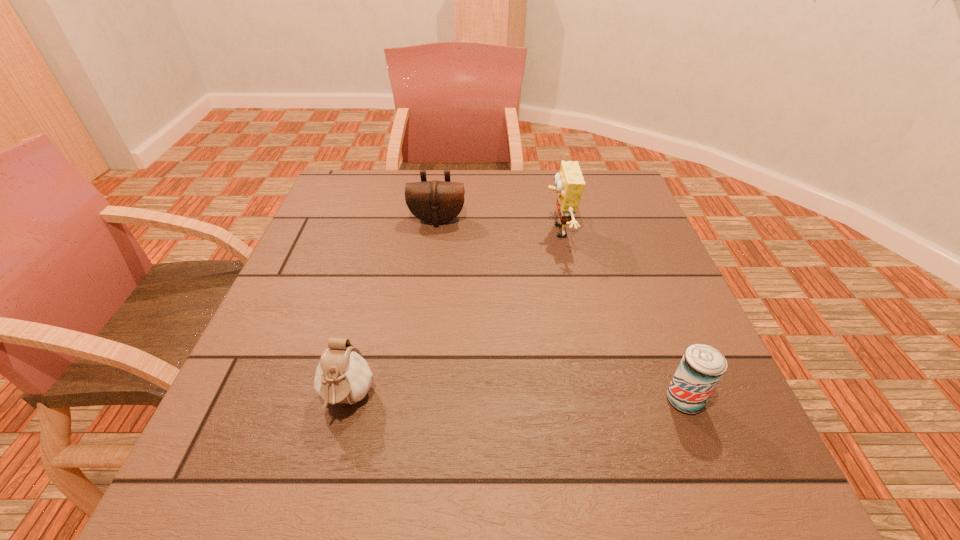
Identify the location of the tallest object. (570, 183).

In order to click on sponge in this screenshot , I will do `click(570, 183)`.

Identify the location of the farther pouch. Image resolution: width=960 pixels, height=540 pixels. (435, 202).

At what (x,y) coordinates should I click in order to perform the action: click on the nearer pouch. Please return your answer as a coordinate pair (x, y). This screenshot has height=540, width=960. Looking at the image, I should click on (343, 376).

You are a GUI agent. You are given a task and a screenshot of the screen. Output one action in this format:
    pyautogui.click(x=<x>, y=<y>)
    Task: Click on the rightmost object
    Image resolution: width=960 pixels, height=540 pixels.
    Given the screenshot: What is the action you would take?
    pyautogui.click(x=702, y=366)

Locate an element on the screen. The width and height of the screenshot is (960, 540). free space located 0.290m on the face of the tallest object is located at coordinates point(432,232).

You are a GUI agent. You are given a task and a screenshot of the screen. Output one action in this format:
    pyautogui.click(x=<x>, y=<y>)
    Task: Click on the vacant space located 0.220m on the face of the tallest object
    
    Given the screenshot: What is the action you would take?
    pyautogui.click(x=459, y=232)

The width and height of the screenshot is (960, 540). Identify the location of free spot located on the face of the tallest object. (409, 232).

Identify the location of free point located 0.160m with the flap open on the farther pouch. This screenshot has height=540, width=960. (431, 268).

The image size is (960, 540). What are the coordinates of `vacant area situated on the front-facing side of the nearer pouch` in the screenshot? It's located at (319, 512).